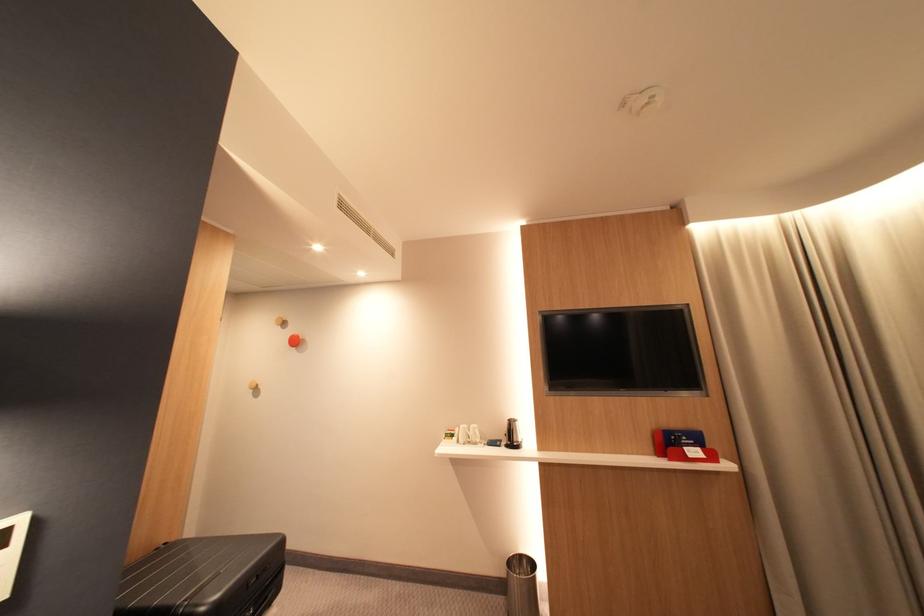
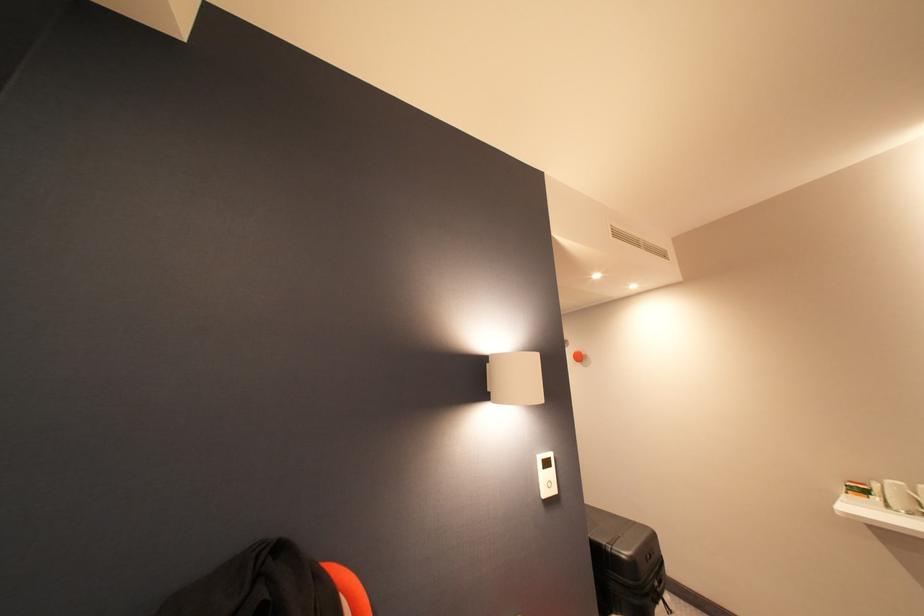
Question: How did the camera likely rotate?

Choices:
 (A) Left
 (B) Right
 (C) Up
 (D) Down

Answer: (A)